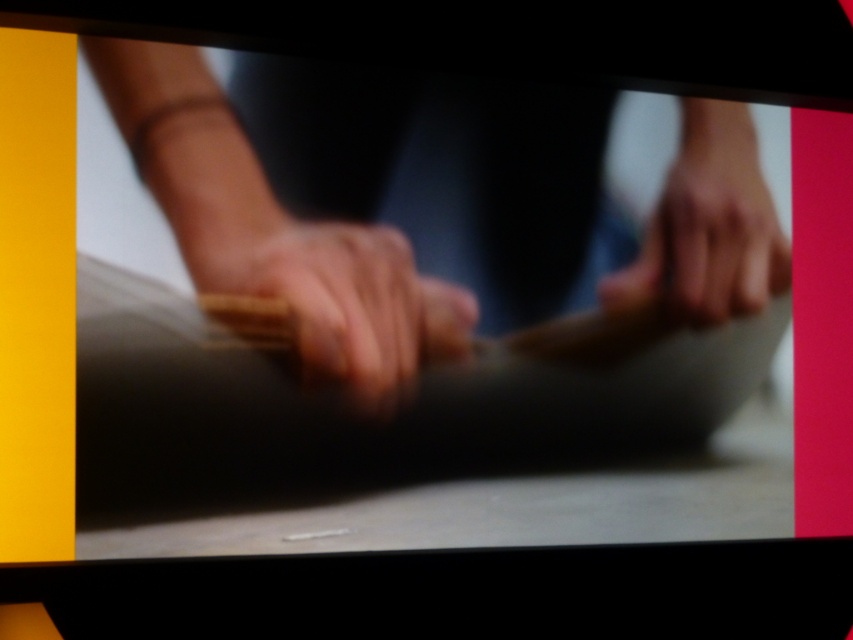
Between point (326, 292) and point (711, 280), which one is positioned in front?

Positioned in front is point (326, 292).

Is smooth beige fabric at center to the right of smooth skin hand at center from the viewer's perspective?

No, smooth beige fabric at center is not to the right of smooth skin hand at center.

In order to click on smooth beige fabric at center in this screenshot , I will do `click(274, 228)`.

Is smooth beige fabric at center shorter than smooth wood drumstick at center?

No.

Describe the element at coordinates (274, 228) in the screenshot. I see `smooth beige fabric at center` at that location.

The width and height of the screenshot is (853, 640). What do you see at coordinates (274, 228) in the screenshot?
I see `smooth beige fabric at center` at bounding box center [274, 228].

Where is `smooth beige fabric at center`? The image size is (853, 640). smooth beige fabric at center is located at coordinates (274, 228).

Who is lower down, smooth wood drumstick at center or smooth skin hand at center?

Positioned lower is smooth wood drumstick at center.

Where is `smooth wood drumstick at center`? This screenshot has width=853, height=640. smooth wood drumstick at center is located at coordinates (343, 298).